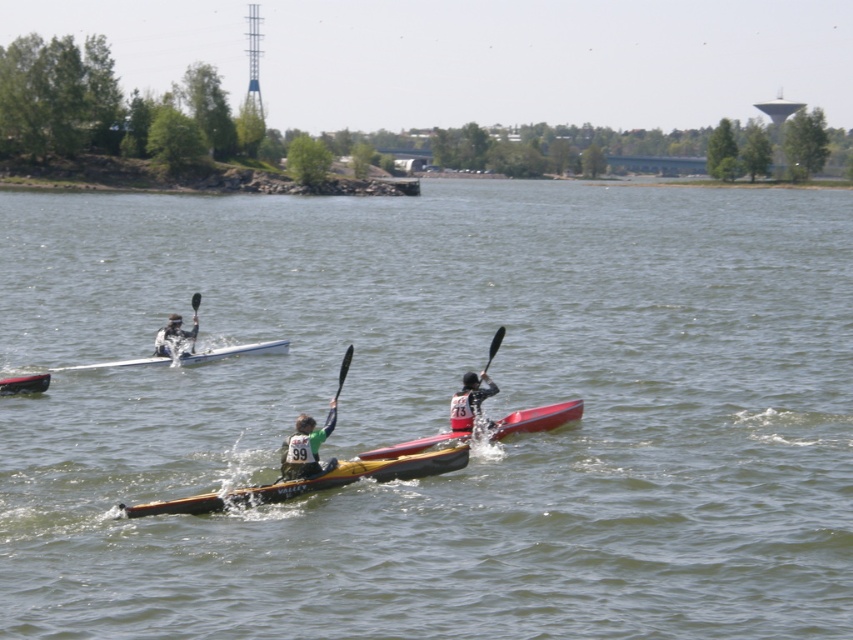
Who is more distant from viewer, (416, 588) or (302, 468)?

Point (302, 468)

Between greenish-brown water at center and green matte kayak at center, which one appears on the left side from the viewer's perspective?

Positioned to the left is greenish-brown water at center.

Does point (367, 589) lie in front of point (302, 464)?

Yes.

This screenshot has height=640, width=853. Identify the location of greenish-brown water at center. (434, 412).

Does white plastic canoe at upper left have a larger size compared to black plastic paddle at center?

Yes, white plastic canoe at upper left is bigger than black plastic paddle at center.

Between white plastic canoe at upper left and black plastic paddle at center, which one has less height?

white plastic canoe at upper left is shorter.

I want to click on white plastic canoe at upper left, so click(236, 352).

Find the location of a particular element. This screenshot has width=853, height=640. white plastic canoe at upper left is located at coordinates 236,352.

Is greenish-brown water at center closer to camera compared to yellow plastic canoe at center?

That is True.

Does point (33, 538) lie in front of point (10, 394)?

Yes, point (33, 538) is in front of point (10, 394).

Where is `greenish-brown water at center`? The width and height of the screenshot is (853, 640). greenish-brown water at center is located at coordinates (434, 412).

Where is `greenish-brown water at center`? The image size is (853, 640). greenish-brown water at center is located at coordinates (434, 412).